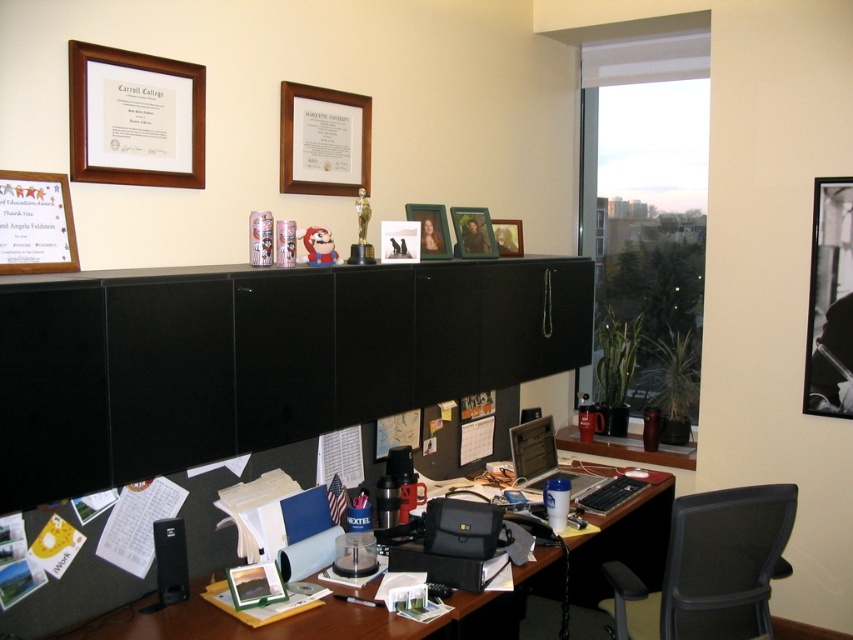
Question: Is wooden desk at lower center closer to the viewer compared to black mesh swivel chair at right?

Choices:
 (A) no
 (B) yes

Answer: (B)

Question: Can you confirm if black matte/file cabinet at center is positioned to the right of matte paper certificate at upper left?

Choices:
 (A) no
 (B) yes

Answer: (B)

Question: Does wooden desk at lower center appear over wooden framed certificate at upper center?

Choices:
 (A) yes
 (B) no

Answer: (B)

Question: Which of the following is the farthest from the observer?

Choices:
 (A) black matte/file cabinet at center
 (B) wooden photo frame at upper center

Answer: (B)

Question: Which object is closer to the camera taking this photo?

Choices:
 (A) wooden desk at lower center
 (B) black glossy picture frame at upper right

Answer: (A)

Question: Based on their relative distances, which object is nearer to the black glossy picture frame at upper right?

Choices:
 (A) wooden picture frame at upper center
 (B) black matte/file cabinet at center
 (C) wooden framed certificate at upper center
 (D) wooden picture frame at upper left

Answer: (A)